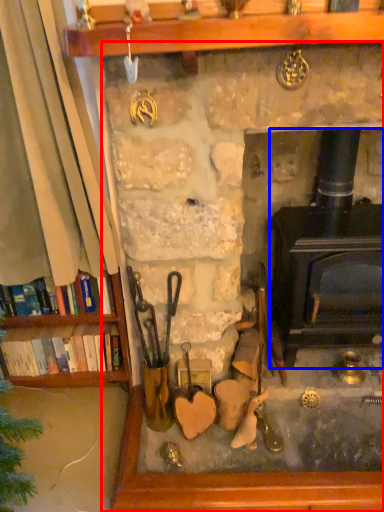
Question: Which object is closer to the camera taking this photo, fireplace (highlighted by a red box) or wood burning stove (highlighted by a blue box)?

Choices:
 (A) fireplace
 (B) wood burning stove

Answer: (A)